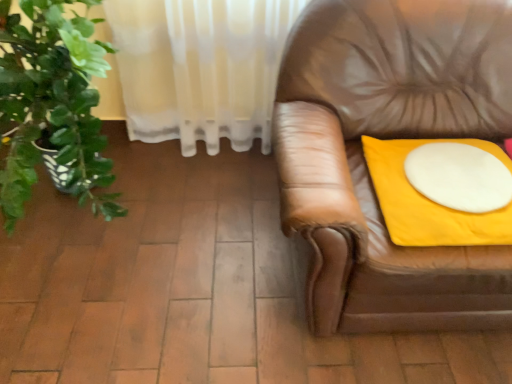
Question: Is white matte round table at right further to camera compared to yellow fabric cushion at right?

Choices:
 (A) no
 (B) yes

Answer: (B)

Question: From a real-world perspective, is white matte round table at right physically above yellow fabric cushion at right?

Choices:
 (A) no
 (B) yes

Answer: (B)

Question: Can you confirm if white matte round table at right is bigger than yellow fabric cushion at right?

Choices:
 (A) yes
 (B) no

Answer: (B)

Question: Is white matte round table at right not within yellow fabric cushion at right?

Choices:
 (A) yes
 (B) no

Answer: (B)

Question: Can you confirm if white matte round table at right is wider than yellow fabric cushion at right?

Choices:
 (A) yes
 (B) no

Answer: (B)

Question: Is white matte round table at right facing towards yellow fabric cushion at right?

Choices:
 (A) no
 (B) yes

Answer: (B)

Question: Is the position of yellow fabric cushion at right more distant than that of white matte round table at right?

Choices:
 (A) yes
 (B) no

Answer: (B)

Question: Is yellow fabric cushion at right far away from white matte round table at right?

Choices:
 (A) yes
 (B) no

Answer: (B)

Question: Is white matte round table at right surrounded by yellow fabric cushion at right?

Choices:
 (A) yes
 (B) no

Answer: (A)

Question: Is yellow fabric cushion at right to the right of white matte round table at right from the viewer's perspective?

Choices:
 (A) yes
 (B) no

Answer: (B)

Question: Is yellow fabric cushion at right not within white matte round table at right?

Choices:
 (A) yes
 (B) no

Answer: (A)

Question: Does yellow fabric cushion at right have a smaller size compared to white matte round table at right?

Choices:
 (A) yes
 (B) no

Answer: (B)

Question: Is yellow fabric cushion at right bigger or smaller than white matte round table at right?

Choices:
 (A) small
 (B) big

Answer: (B)